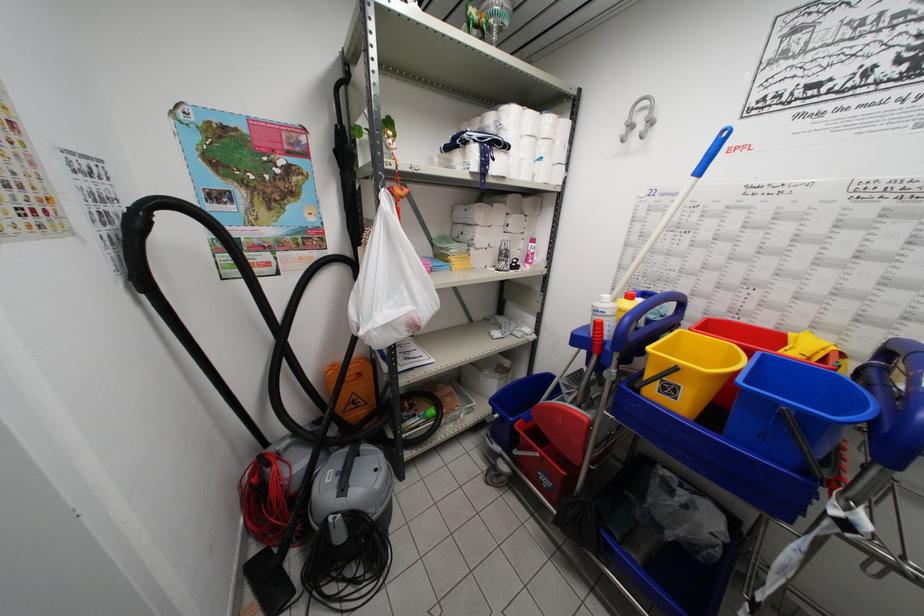
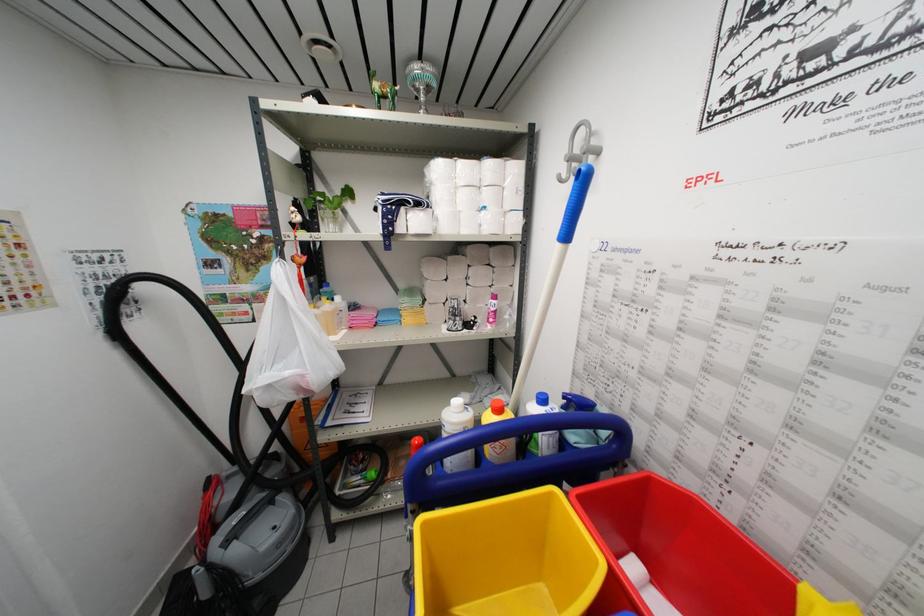
In the second image, find the point that corresponds to pixel 684 337 in the first image.

(554, 498)